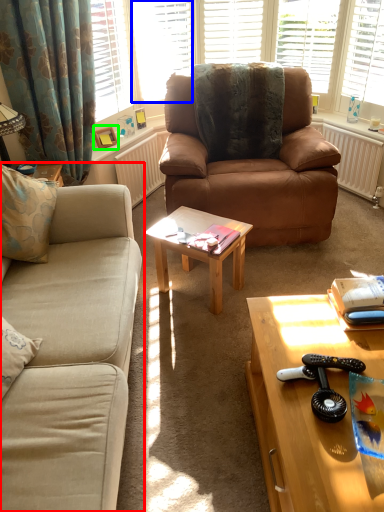
Question: Which object is the farthest from studio couch (highlighted by a red box)? Choose among these: window (highlighted by a blue box) or picture frame (highlighted by a green box).

Choices:
 (A) window
 (B) picture frame

Answer: (A)